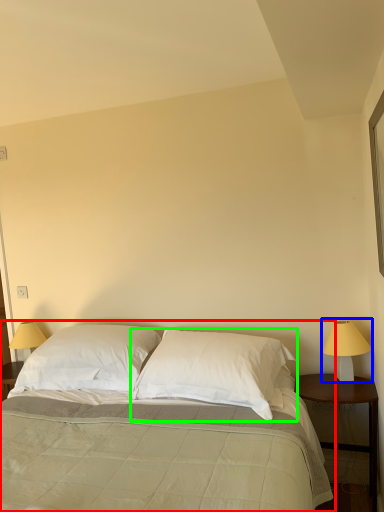
Question: Based on their relative distances, which object is farther from bed (highlighted by a red box)? Choose from bedside lamp (highlighted by a blue box) and pillow (highlighted by a green box).

Choices:
 (A) bedside lamp
 (B) pillow

Answer: (A)